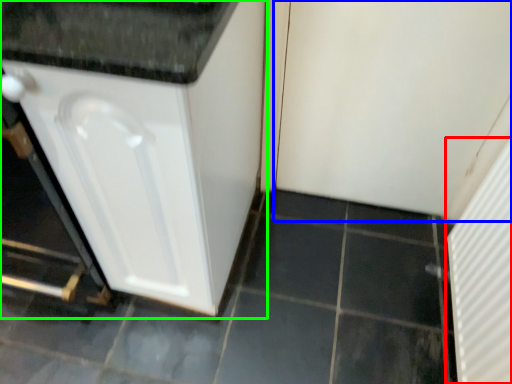
Question: Based on their relative distances, which object is farther from screen door (highlighted by a red box)? Choose from screen door (highlighted by a blue box) and cabinetry (highlighted by a green box).

Choices:
 (A) screen door
 (B) cabinetry

Answer: (B)